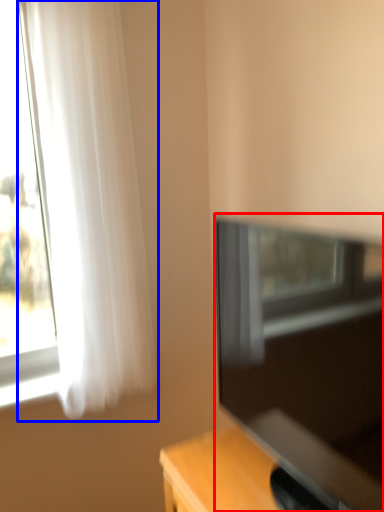
Question: Which point is further to the camera, television (highlighted by a red box) or curtain (highlighted by a blue box)?

Choices:
 (A) television
 (B) curtain

Answer: (B)